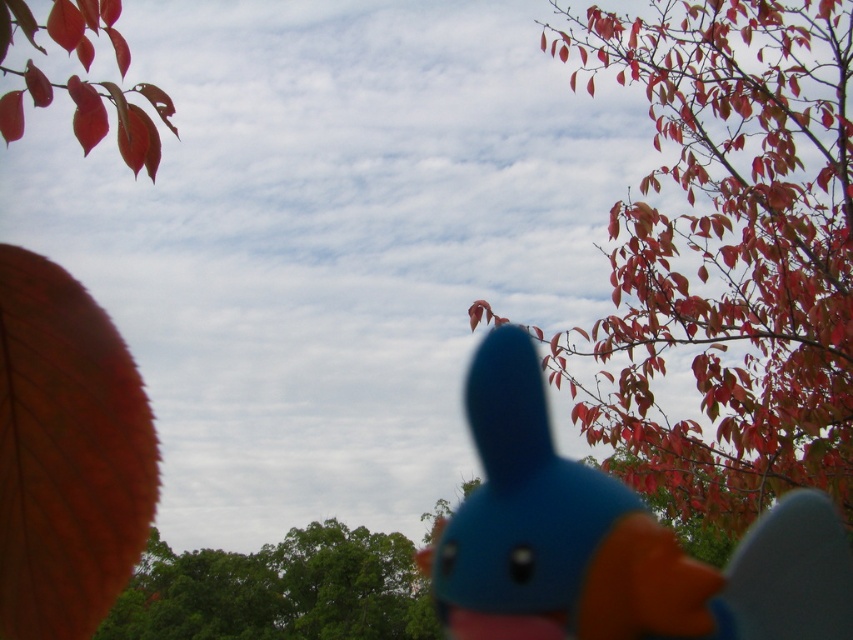
Can you confirm if smooth red leaves at upper right is positioned above green leafy tree at lower left?

Yes.

Between point (722, 120) and point (335, 547), which one is positioned behind?

The point (335, 547) is behind.

Is point (848, 80) in front of point (282, 611)?

Yes.

This screenshot has height=640, width=853. Identify the location of smooth red leaves at upper right. (728, 252).

Is point (521, 560) more distant than point (117, 609)?

No, (521, 560) is in front of (117, 609).

Is blue rubber duck at center bigger than green leafy tree at lower left?

Incorrect, blue rubber duck at center is not larger than green leafy tree at lower left.

The height and width of the screenshot is (640, 853). What are the coordinates of `blue rubber duck at center` in the screenshot? It's located at (611, 541).

Does point (708, 161) come behind point (772, 522)?

That is True.

Does smooth red leaves at upper right lie behind blue rubber duck at center?

Yes, smooth red leaves at upper right is behind blue rubber duck at center.

The image size is (853, 640). Find the location of `smooth red leaves at upper right`. smooth red leaves at upper right is located at coordinates (728, 252).

Locate an element on the screen. Image resolution: width=853 pixels, height=640 pixels. smooth red leaves at upper right is located at coordinates (728, 252).